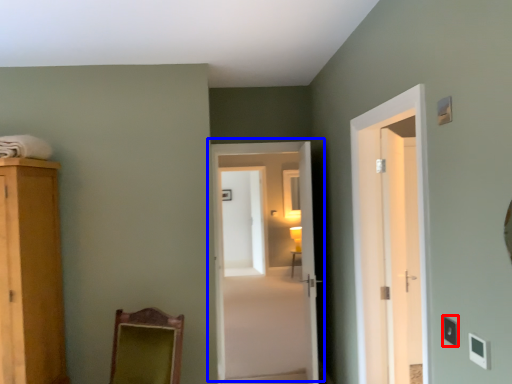
Question: Which of the following is the closest to the observer, light switch (highlighted by a red box) or door (highlighted by a blue box)?

Choices:
 (A) light switch
 (B) door

Answer: (A)